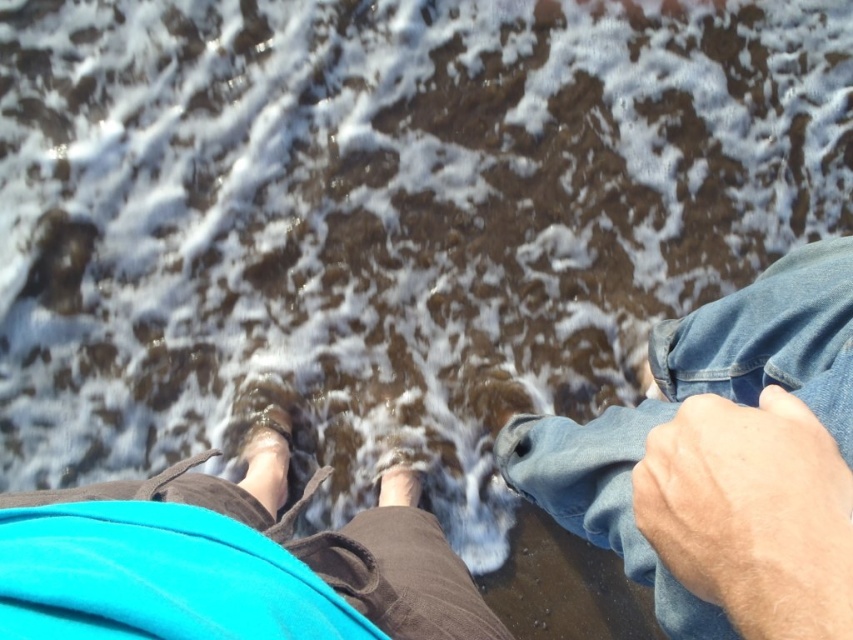
You are a photographer trying to capture a close shot of the smooth skin foot at center without the brown suede sandal at lower center blocking it. Based on their positions, is it possible to adjust your camera angle to achieve this?

The brown suede sandal at lower center is in front of the smooth skin foot at center, so adjusting the camera angle to shoot from behind the sandal would allow you to capture the foot without obstruction.

You are standing at the edge of the water and want to place a 50 cm long object between you and the denim at lower right. Is there enough space?

The denim at lower right is 61.71 centimeters away from the viewer. Since the object is 50 cm long, there is enough space to place it between you and the denim at lower right.

Based on the scene described, which object, denim at lower right or smooth skin foot at center, has a greater width?

The denim at lower right is wider than the smooth skin foot at center according to the description.